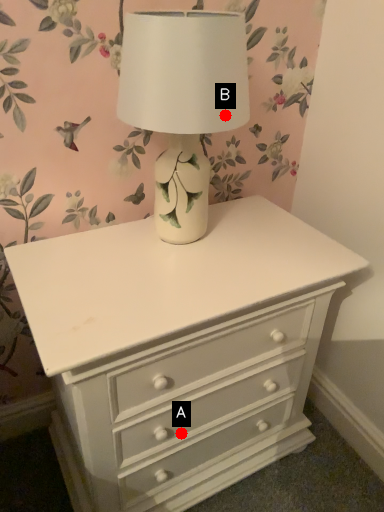
Question: Two points are circled on the image, labeled by A and B beside each circle. Among these points, which one is farthest from the camera?

Choices:
 (A) A is further
 (B) B is further

Answer: (A)